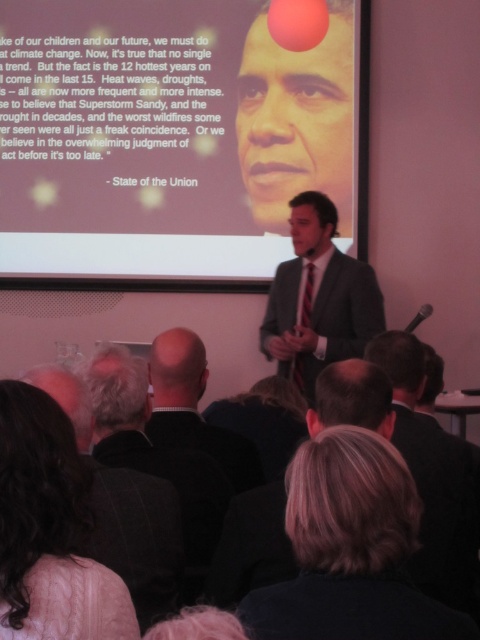
You are an attendee at this presentation. You notice two items at the center of the image labeled as blonde hair at center and dark suit at center. Which one is shorter in height?

The blonde hair at center has a lesser height compared to dark suit at center, so the blonde hair at center is shorter.

You are an event organizer setting up for a presentation. You need to ensure that the white matte projection screen at upper center and the dark suit at center are positioned correctly. Based on the scene description, which object is wider?

The white matte projection screen at upper center might be wider than the dark suit at center according to the description.

You are an attendee at the presentation and want to take a photo of the white matte projection screen at upper center and the white knitted sweater at lower left. Which object should you focus on first if you want to capture both in one shot without moving the camera?

You should focus on the white knitted sweater at lower left first because the white matte projection screen at upper center is above it, so adjusting focus from the lower to the upper object will ensure both are in frame.